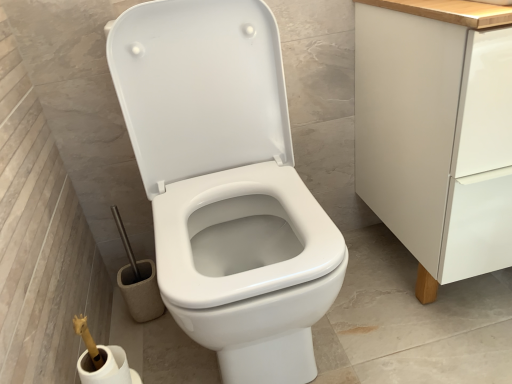
Measure the distance between white matte toilet paper at lower left and camera.

A distance of 73.90 centimeters exists between white matte toilet paper at lower left and camera.

This screenshot has height=384, width=512. I want to click on white glossy toilet at center, so click(226, 184).

From a real-world perspective, which object rests below the other?

white matte cabinet at right.

Considering the relative positions of white matte cabinet at right and white glossy toilet at center in the image provided, is white matte cabinet at right to the left or to the right of white glossy toilet at center?

From the image, it's evident that white matte cabinet at right is to the right of white glossy toilet at center.

Is white matte cabinet at right in front of or behind white glossy toilet at center in the image?

white matte cabinet at right is behind white glossy toilet at center.

Is white matte cabinet at right next to white glossy toilet at center?

No, white matte cabinet at right is not making contact with white glossy toilet at center.

Considering the positions of point (223, 109) and point (403, 0), is point (223, 109) closer or farther from the camera than point (403, 0)?

Point (223, 109) appears to be farther away from the viewer than point (403, 0).

Which object is wider, white glossy toilet at center or white matte cabinet at right?

white glossy toilet at center is wider.

Is white glossy toilet at center touching white matte cabinet at right?

No, white glossy toilet at center is not in contact with white matte cabinet at right.

Consider the image. Which is more to the right, white matte cabinet at right or white matte toilet paper at lower left?

white matte cabinet at right is more to the right.

Does white matte cabinet at right have a lesser height compared to white matte toilet paper at lower left?

No.

How distant is white matte cabinet at right from white matte toilet paper at lower left?

white matte cabinet at right and white matte toilet paper at lower left are 31.36 inches apart.

From a real-world perspective, is white matte cabinet at right physically located above or below white matte toilet paper at lower left?

Clearly, from a real-world perspective, white matte cabinet at right is above white matte toilet paper at lower left.

Between white matte toilet paper at lower left and white glossy toilet at center, which one is positioned behind?

Positioned behind is white matte toilet paper at lower left.

Considering the sizes of objects white matte toilet paper at lower left and white glossy toilet at center in the image provided, who is thinner, white matte toilet paper at lower left or white glossy toilet at center?

white matte toilet paper at lower left is thinner.

Is white matte toilet paper at lower left surrounding white glossy toilet at center?

Actually, white glossy toilet at center is outside white matte toilet paper at lower left.

Considering the relative sizes of white matte toilet paper at lower left and white glossy toilet at center in the image provided, is white matte toilet paper at lower left taller than white glossy toilet at center?

No.

Based on their sizes in the image, would you say white glossy toilet at center is bigger or smaller than white matte toilet paper at lower left?

white glossy toilet at center is bigger than white matte toilet paper at lower left.

The height and width of the screenshot is (384, 512). I want to click on toilet on the right of white matte toilet paper at lower left, so tap(226, 184).

From a real-world perspective, which is physically above, white glossy toilet at center or white matte toilet paper at lower left?

white glossy toilet at center, from a real-world perspective.

In the scene shown: From a real-world perspective, between white matte toilet paper at lower left and white matte cabinet at right, who is vertically lower?

From a 3D spatial view, white matte toilet paper at lower left is below.

Considering the relative sizes of white matte toilet paper at lower left and white matte cabinet at right in the image provided, is white matte toilet paper at lower left shorter than white matte cabinet at right?

Yes, white matte toilet paper at lower left is shorter than white matte cabinet at right.

Considering the sizes of white matte toilet paper at lower left and white matte cabinet at right in the image, is white matte toilet paper at lower left bigger or smaller than white matte cabinet at right?

Considering their sizes, white matte toilet paper at lower left takes up less space than white matte cabinet at right.

What are the coordinates of `cabinetry above the white matte toilet paper at lower left (from the image's perspective)` in the screenshot? It's located at (437, 131).

Locate an element on the screen. toilet below the white matte cabinet at right (from the image's perspective) is located at coordinates (226, 184).

Find the location of a particular element. The image size is (512, 384). cabinetry that appears below the white glossy toilet at center (from a real-world perspective) is located at coordinates (437, 131).

From the image, which object appears to be farther from white glossy toilet at center, white matte toilet paper at lower left or white matte cabinet at right?

Based on the image, white matte toilet paper at lower left appears to be further to white glossy toilet at center.

Consider the image. Which object lies further to the anchor point white glossy toilet at center, white matte cabinet at right or white matte toilet paper at lower left?

Among the two, white matte toilet paper at lower left is located further to white glossy toilet at center.

Based on the photo, when comparing their distances from white matte toilet paper at lower left, does white glossy toilet at center or white matte cabinet at right seem further?

white matte cabinet at right is positioned further to the anchor white matte toilet paper at lower left.

From the image, which object appears to be nearer to white matte cabinet at right, white glossy toilet at center or white matte toilet paper at lower left?

Among the two, white glossy toilet at center is located nearer to white matte cabinet at right.

From the image, which object appears to be farther from white matte toilet paper at lower left, white matte cabinet at right or white glossy toilet at center?

Based on the image, white matte cabinet at right appears to be further to white matte toilet paper at lower left.

Estimate the real-world distances between objects in this image. Which object is further from white matte cabinet at right, white matte toilet paper at lower left or white glossy toilet at center?

Based on the image, white matte toilet paper at lower left appears to be further to white matte cabinet at right.

Locate an element on the screen. Image resolution: width=512 pixels, height=384 pixels. toilet between white matte toilet paper at lower left and white matte cabinet at right is located at coordinates (226, 184).